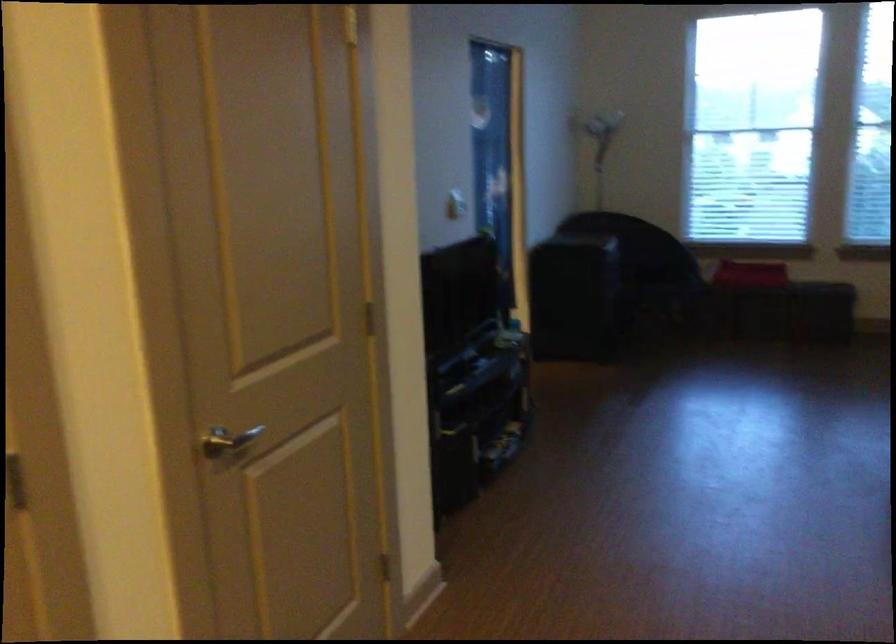
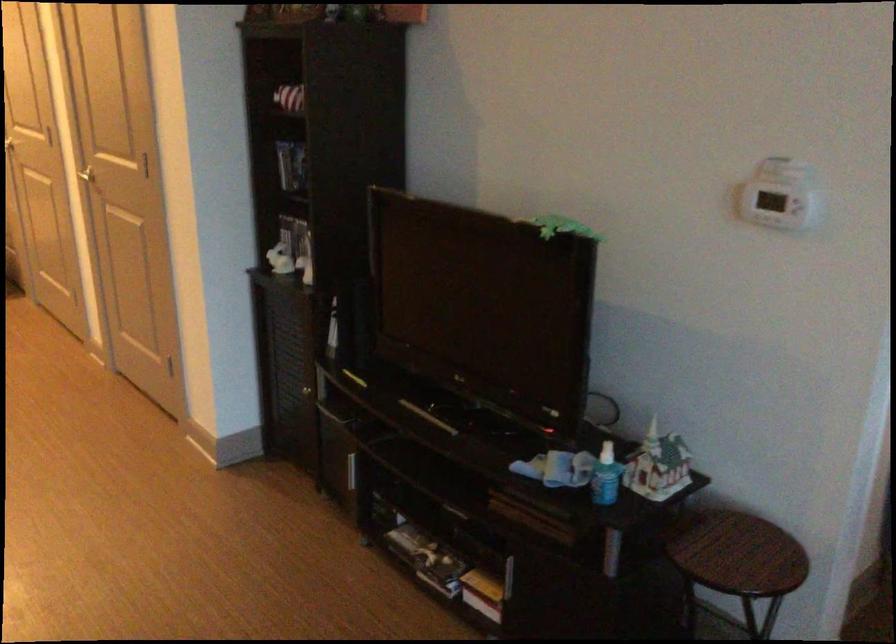
Locate, in the second image, the point that corresponds to [519,315] in the first image.

(606, 476)